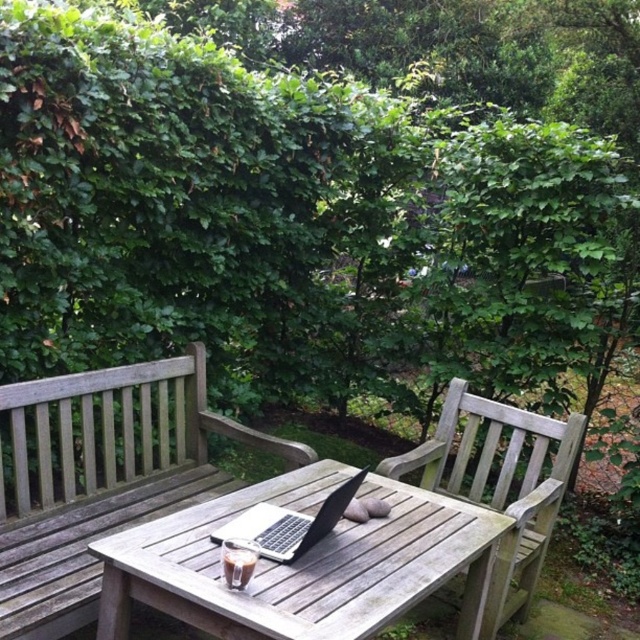
You are standing at the point marked by the coordinates point (499,484) in the image. What object are you standing on?

You are standing on the weathered wood park bench at center marked by the coordinates point (499,484).

You are planning to place a new decorative item on the wooden table between the weathered wood park bench at center and the satin black laptop at center. Considering their sizes, which object should you avoid placing the item closer to to prevent overcrowding?

The weathered wood park bench at center is bigger than the satin black laptop at center, so you should avoid placing the item closer to the weathered wood park bench at center to prevent overcrowding.

From the picture: You are setting up a laptop for work in the garden. You see the wooden picnic table at center and the satin black laptop at center. Which object should you place the laptop on to ensure it is positioned correctly according to the scene?

The satin black laptop at center is already placed on the wooden picnic table at center as per the scene description.